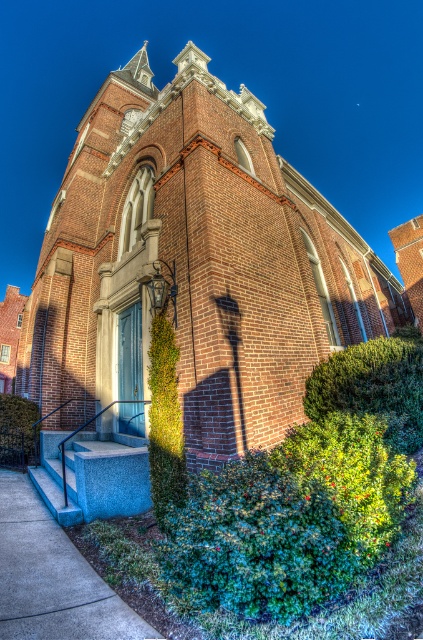
Question: Can you confirm if green leafy hedge at lower right is positioned above green leafy hedge at center?

Choices:
 (A) yes
 (B) no

Answer: (A)

Question: Which object is positioned closest to the brick church at center?

Choices:
 (A) concrete at lower left
 (B) green leafy hedge at lower right
 (C) green leafy hedge at center
 (D) green leafy hedge at lower left

Answer: (D)

Question: Is green leafy hedge at center further to camera compared to green leafy hedge at lower left?

Choices:
 (A) yes
 (B) no

Answer: (B)

Question: Which of the following is the farthest from the observer?

Choices:
 (A) (389, 401)
 (B) (10, 416)

Answer: (B)

Question: Which is farther from the brick church at center?

Choices:
 (A) green leafy hedge at center
 (B) green leafy hedge at lower right

Answer: (B)

Question: From the image, what is the correct spatial relationship of concrete at lower left in relation to green leafy hedge at center?

Choices:
 (A) right
 (B) left

Answer: (B)